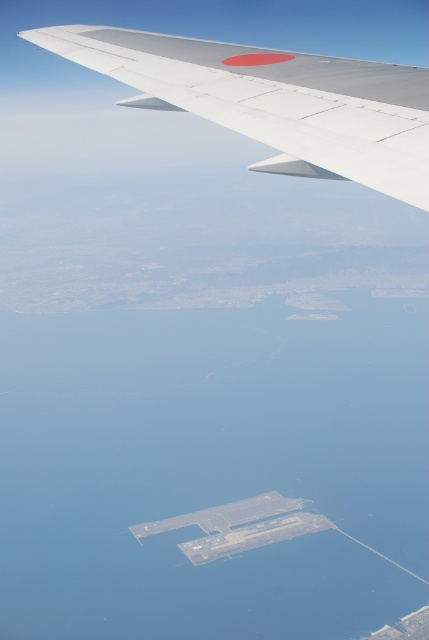
Does transparent water at center have a greater width compared to metallic gray wing at upper left?

Correct, the width of transparent water at center exceeds that of metallic gray wing at upper left.

Is transparent water at center thinner than metallic gray wing at upper left?

Incorrect, transparent water at center's width is not less than metallic gray wing at upper left's.

Is point (30, 456) farther from camera compared to point (407, 113)?

Yes, point (30, 456) is behind point (407, 113).

At what (x,y) coordinates should I click in order to perform the action: click on transparent water at center. Please return your answer as a coordinate pair (x, y). Looking at the image, I should click on (211, 468).